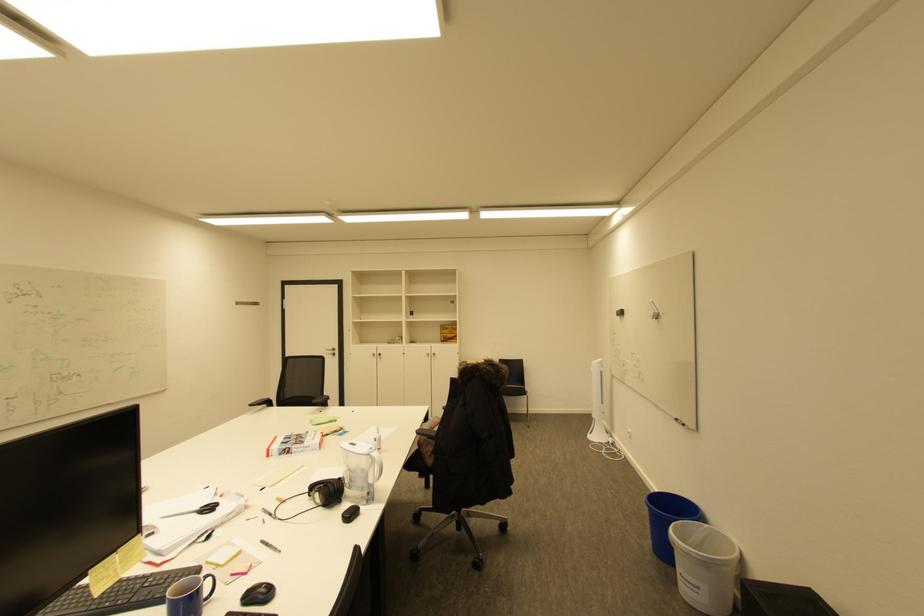
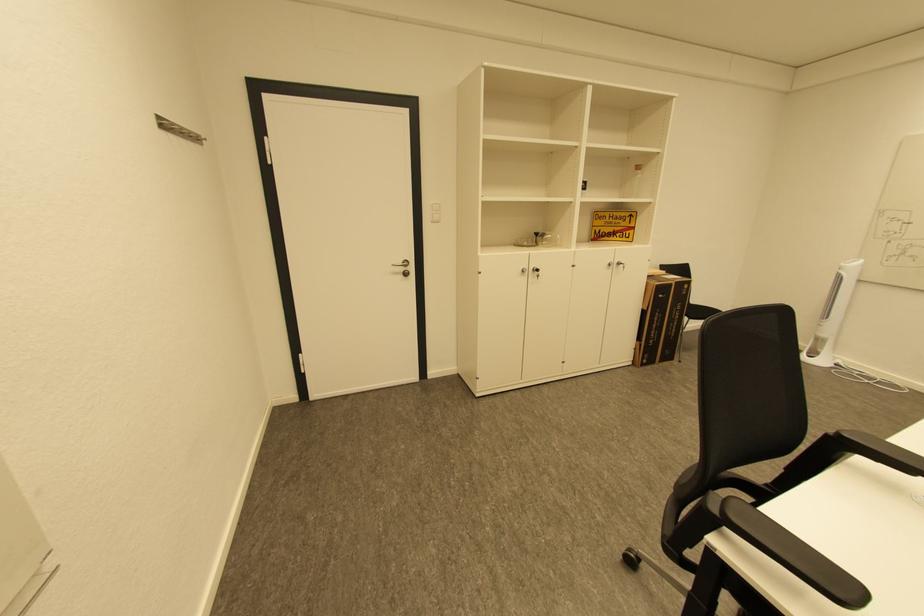
The point at (338, 352) is marked in the first image. Where is the corresponding point in the second image?

(408, 270)